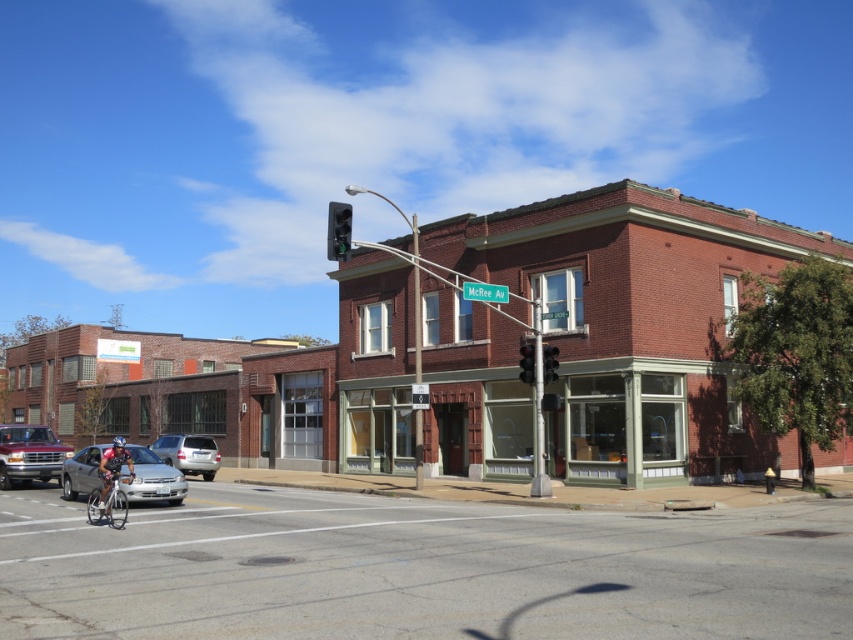
Looking at this image, you are standing at the point marked by the coordinates (x=635, y=323) on the image. What object is located exactly at that point?

The brick building at center is located exactly at point (x=635, y=323).

You are standing at the intersection of McRee Avenue and another street. You need to locate the brick building at center. According to the coordinates provided, where exactly is it positioned?

The brick building at center is located at point coordinates of 0.505 on the x axis and 0.746 on the y axis.